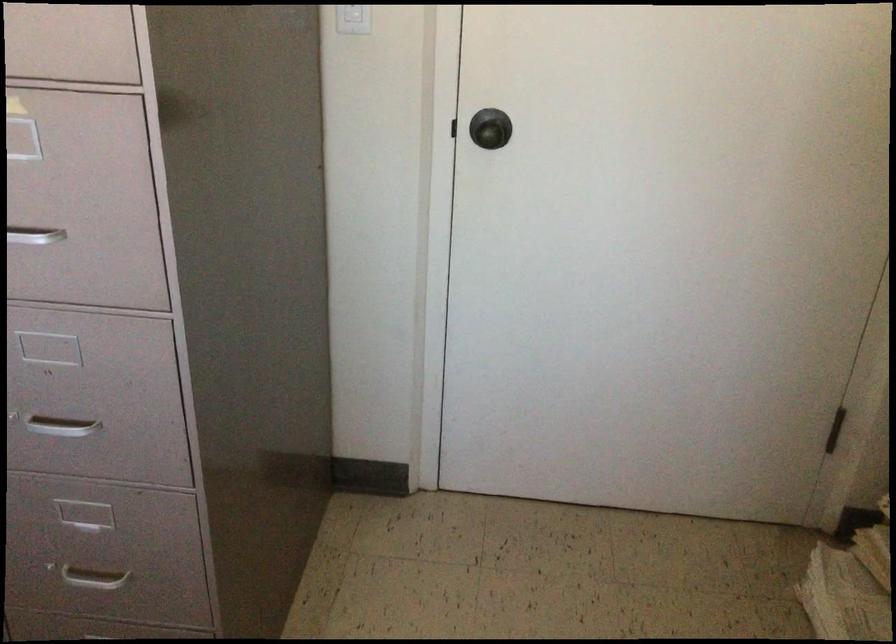
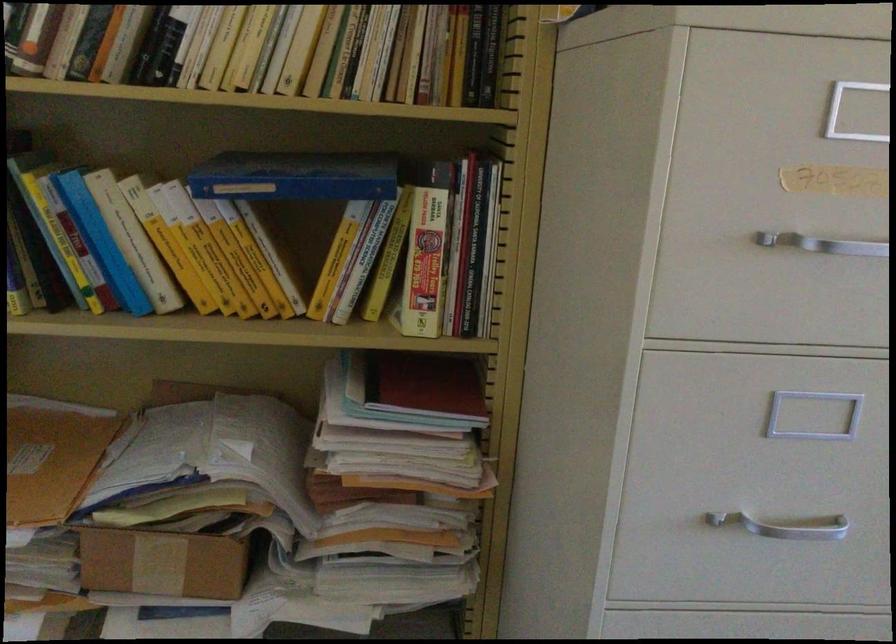
Based on the continuous images, in which direction is the camera rotating?

The camera's rotation is toward right-down.